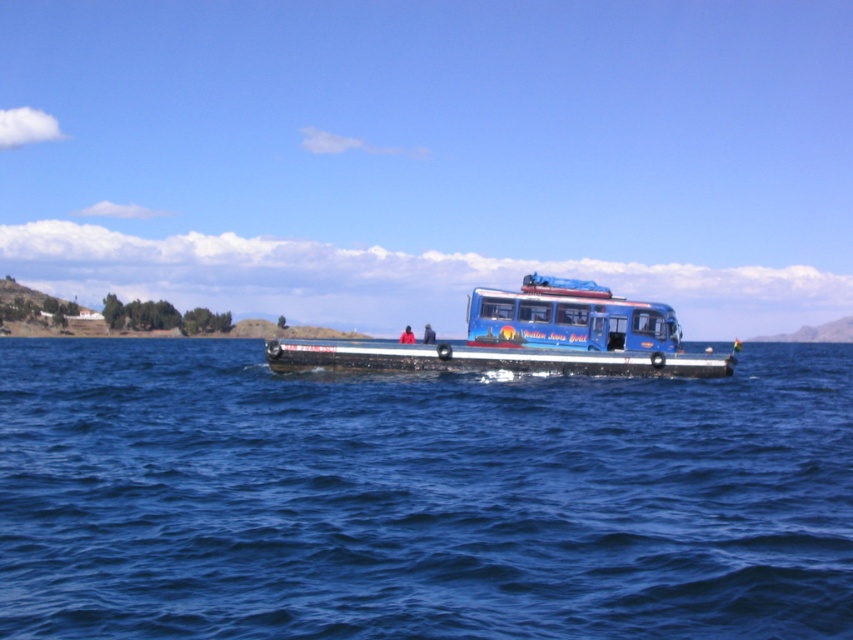
You are standing on the shore of the lake and see the blue water at center and the blue matte bus at center. How far apart are these two objects from each other?

The blue water at center and the blue matte bus at center are 39.57 feet apart from each other.

In the scene shown: You are planning to cross the water in a small boat that can only carry items up to the width of the blue matte bus at center. Can the blue water at center accommodate your boat if you want to navigate through it?

The blue water at center has a larger width than the blue matte bus at center. Since your boat can carry items up to the width of the bus, the water is wide enough to accommodate your boat for navigation.